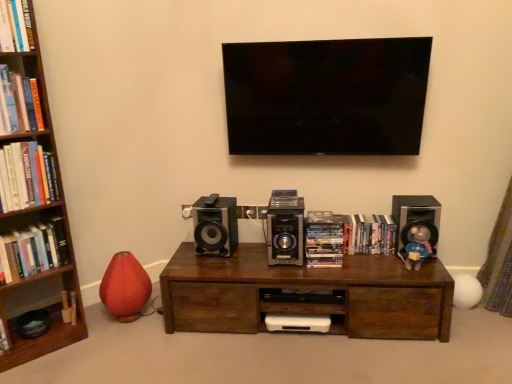
You are a GUI agent. You are given a task and a screenshot of the screen. Output one action in this format:
    pyautogui.click(x=<x>, y=<y>)
    Task: Click on the free space between satin black speaker at right, which ranks as the third speaker in left-to-right order, and hardcover books at center, which appears as the 6th book when viewed from the left
    Image resolution: width=512 pixels, height=384 pixels.
    Given the screenshot: What is the action you would take?
    pyautogui.click(x=377, y=252)